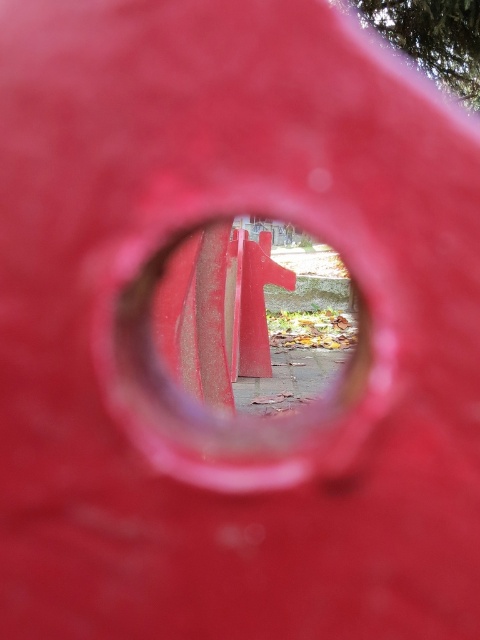
Question: Does smooth matte wood at center have a lesser width compared to smooth red traffic cone at center?

Choices:
 (A) yes
 (B) no

Answer: (A)

Question: Can you confirm if smooth matte wood at center is wider than smooth red traffic cone at center?

Choices:
 (A) yes
 (B) no

Answer: (B)

Question: Does smooth matte wood at center appear on the left side of smooth red traffic cone at center?

Choices:
 (A) yes
 (B) no

Answer: (A)